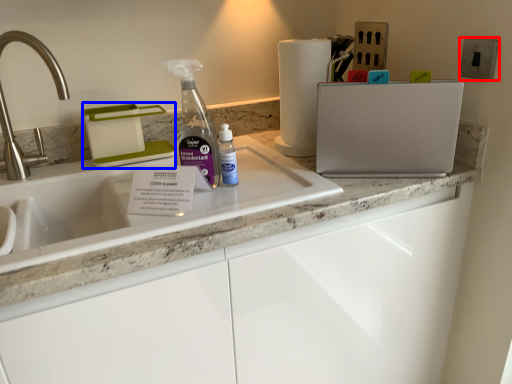
Question: Which object appears closest to the camera in this image, electric outlet (highlighted by a red box) or appliance (highlighted by a blue box)?

Choices:
 (A) electric outlet
 (B) appliance

Answer: (A)